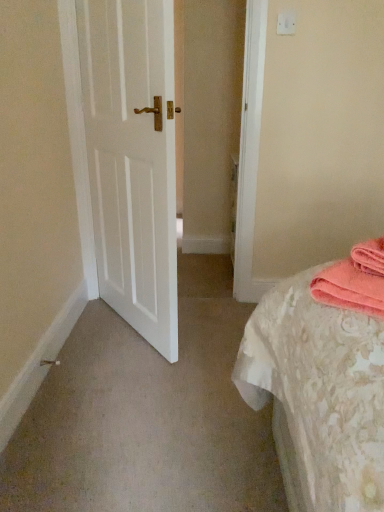
Measure the distance between white matte door at left and camera.

4.33 feet.

Locate an element on the screen. The image size is (384, 512). pink towel at right is located at coordinates (355, 280).

What is the approximate height of pink towel at right?

It is 3.90 inches.

You are a GUI agent. You are given a task and a screenshot of the screen. Output one action in this format:
    pyautogui.click(x=<x>, y=<y>)
    Task: Click on the white matte door at left
    This screenshot has height=512, width=384.
    Given the screenshot: What is the action you would take?
    pyautogui.click(x=132, y=160)

Do you think white matte door at left is within pink towel at right, or outside of it?

white matte door at left is spatially situated outside pink towel at right.

Find the location of a particular element. The width and height of the screenshot is (384, 512). door above the pink towel at right (from the image's perspective) is located at coordinates (132, 160).

From a real-world perspective, is white matte door at left physically located above or below pink towel at right?

white matte door at left is situated higher than pink towel at right in the real world.

Can you tell me how much white matte door at left and pink towel at right differ in facing direction?

93.6 degrees.

Is pink towel at right turned away from white plastic light switch at upper center?

No, white plastic light switch at upper center is not at the back of pink towel at right.

Which point is more distant from viewer, [337,303] or [286,19]?

Positioned behind is point [286,19].

Considering the positions of objects pink towel at right and white plastic light switch at upper center in the image provided, who is more to the left, pink towel at right or white plastic light switch at upper center?

white plastic light switch at upper center is more to the left.

From the image's perspective, is pink towel at right on top of white plastic light switch at upper center?

No, from the image's perspective, pink towel at right is not on top of white plastic light switch at upper center.

Which is less distant, (295, 28) or (352, 276)?

Point (352, 276)

Is the position of white plastic light switch at upper center more distant than that of pink towel at right?

Yes, white plastic light switch at upper center is further from the camera.

Would you say white plastic light switch at upper center is a long distance from pink towel at right?

Indeed, white plastic light switch at upper center is not near pink towel at right.

Which point is more forward, (351, 303) or (172, 83)?

Point (351, 303)

How distant is pink towel at right from white matte door at left?

The distance of pink towel at right from white matte door at left is 3.48 feet.

From their relative heights in the image, would you say pink towel at right is taller or shorter than white matte door at left?

pink towel at right is shorter than white matte door at left.

Considering the relative sizes of pink towel at right and white matte door at left in the image provided, is pink towel at right thinner than white matte door at left?

In fact, pink towel at right might be wider than white matte door at left.

Between white plastic light switch at upper center and white matte door at left, which one appears on the left side from the viewer's perspective?

white matte door at left.

Is white plastic light switch at upper center turned away from white matte door at left?

No, white plastic light switch at upper center's orientation is not away from white matte door at left.

Find the location of `light switch above the white matte door at left (from a real-world perspective)`. light switch above the white matte door at left (from a real-world perspective) is located at coordinates (286, 23).

Can you tell me how much white plastic light switch at upper center and white matte door at left differ in facing direction?

The angular difference between white plastic light switch at upper center and white matte door at left is 124 degrees.

Is white matte door at left aimed at white plastic light switch at upper center?

Yes.

Considering the relative positions of white matte door at left and white plastic light switch at upper center in the image provided, is white matte door at left in front of white plastic light switch at upper center?

Yes, it is in front of white plastic light switch at upper center.

From the image's perspective, would you say white matte door at left is shown under white plastic light switch at upper center?

Indeed, from the image's perspective, white matte door at left is shown beneath white plastic light switch at upper center.

Is white plastic light switch at upper center inside white matte door at left?

No, white plastic light switch at upper center is located outside of white matte door at left.

The image size is (384, 512). What are the coordinates of `door behind the pink towel at right` in the screenshot? It's located at (132, 160).

Locate an element on the screen. The image size is (384, 512). material in front of the white plastic light switch at upper center is located at coordinates (355, 280).

Which object lies nearer to the anchor point white plastic light switch at upper center, white matte door at left or pink towel at right?

Among the two, white matte door at left is located nearer to white plastic light switch at upper center.

Which object lies further to the anchor point white plastic light switch at upper center, pink towel at right or white matte door at left?

Among the two, pink towel at right is located further to white plastic light switch at upper center.

Looking at the image, which one is located closer to white matte door at left, white plastic light switch at upper center or pink towel at right?

white plastic light switch at upper center lies closer to white matte door at left than the other object.

From the picture: Considering their positions, is white plastic light switch at upper center positioned further to pink towel at right than white matte door at left?

white plastic light switch at upper center.

Looking at the image, which one is located closer to white matte door at left, pink towel at right or white plastic light switch at upper center?

Based on the image, white plastic light switch at upper center appears to be nearer to white matte door at left.

Which object lies nearer to the anchor point pink towel at right, white matte door at left or white plastic light switch at upper center?

The object closer to pink towel at right is white matte door at left.

You are a GUI agent. You are given a task and a screenshot of the screen. Output one action in this format:
    pyautogui.click(x=<x>, y=<y>)
    Task: Click on the door between pink towel at right and white plastic light switch at upper center along the z-axis
    
    Given the screenshot: What is the action you would take?
    pyautogui.click(x=132, y=160)